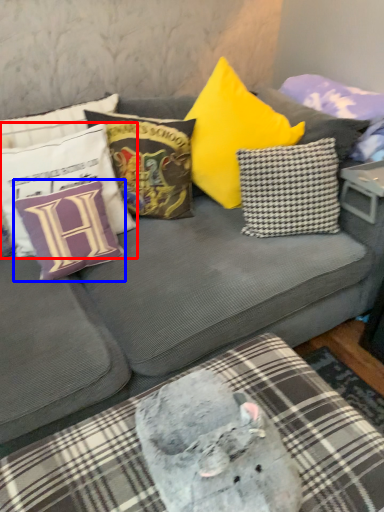
Question: Which object appears farthest to the camera in this image, pillow (highlighted by a red box) or pillow (highlighted by a blue box)?

Choices:
 (A) pillow
 (B) pillow

Answer: (B)